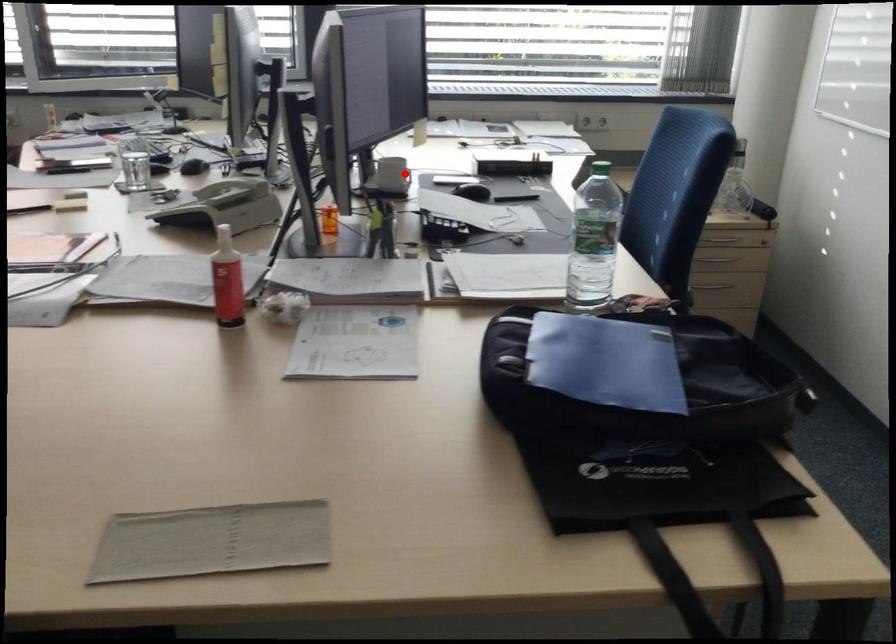
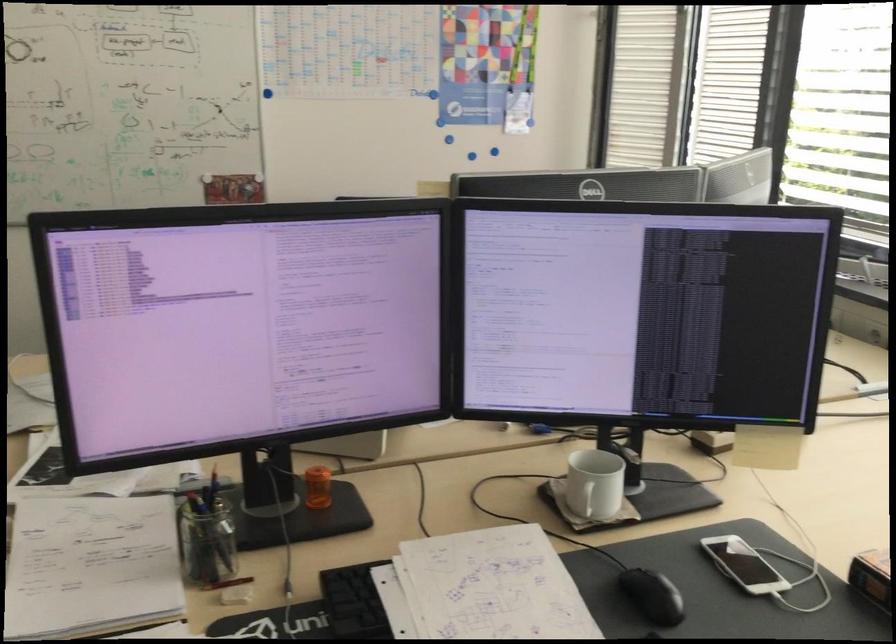
Where in the second image is the point corresponding to the highlighted location from the first image?

(583, 498)